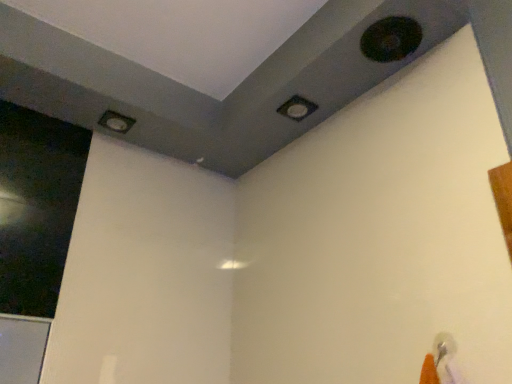
Question: Can you confirm if matte gray hole at upper left, the third hole in the top-to-bottom sequence, is thinner than matte black square at upper center, positioned as the second hole in back-to-front order?

Choices:
 (A) yes
 (B) no

Answer: (B)

Question: Is matte gray hole at upper left, which is the third hole from right to left, oriented towards matte black square at upper center, acting as the second hole starting from the bottom?

Choices:
 (A) yes
 (B) no

Answer: (B)

Question: Can you confirm if matte gray hole at upper left, which appears as the first hole when viewed from the back, is positioned to the right of matte black square at upper center, the second hole in the right-to-left sequence?

Choices:
 (A) no
 (B) yes

Answer: (A)

Question: From a real-world perspective, is matte gray hole at upper left, the third hole viewed from the front, below matte black square at upper center, which is the 2th hole from top to bottom?

Choices:
 (A) yes
 (B) no

Answer: (A)

Question: From the image's perspective, is matte gray hole at upper left, which is the third hole from right to left, under matte black square at upper center, positioned as the second hole in back-to-front order?

Choices:
 (A) yes
 (B) no

Answer: (A)

Question: Is matte gray hole at upper left, which is the third hole from right to left, positioned in front of matte black square at upper center, positioned as the second hole in back-to-front order?

Choices:
 (A) no
 (B) yes

Answer: (A)

Question: Is transparent glass screen door at left bigger than black matte hole at upper right, which is counted as the 1th hole, starting from the front?

Choices:
 (A) yes
 (B) no

Answer: (A)

Question: From a real-world perspective, is transparent glass screen door at left over black matte hole at upper right, marked as the first hole in a right-to-left arrangement?

Choices:
 (A) no
 (B) yes

Answer: (A)

Question: Does transparent glass screen door at left appear on the right side of black matte hole at upper right, which is the first hole in top-to-bottom order?

Choices:
 (A) no
 (B) yes

Answer: (A)

Question: Is transparent glass screen door at left looking in the opposite direction of black matte hole at upper right, arranged as the 3th hole when viewed from the back?

Choices:
 (A) yes
 (B) no

Answer: (B)

Question: Is transparent glass screen door at left further to the viewer compared to black matte hole at upper right, marked as the first hole in a right-to-left arrangement?

Choices:
 (A) yes
 (B) no

Answer: (A)

Question: Is transparent glass screen door at left directly adjacent to black matte hole at upper right, the 3th hole when ordered from left to right?

Choices:
 (A) yes
 (B) no

Answer: (B)

Question: Considering the relative sizes of matte black square at upper center, placed as the second hole when sorted from left to right, and transparent glass screen door at left in the image provided, is matte black square at upper center, placed as the second hole when sorted from left to right, shorter than transparent glass screen door at left?

Choices:
 (A) yes
 (B) no

Answer: (A)